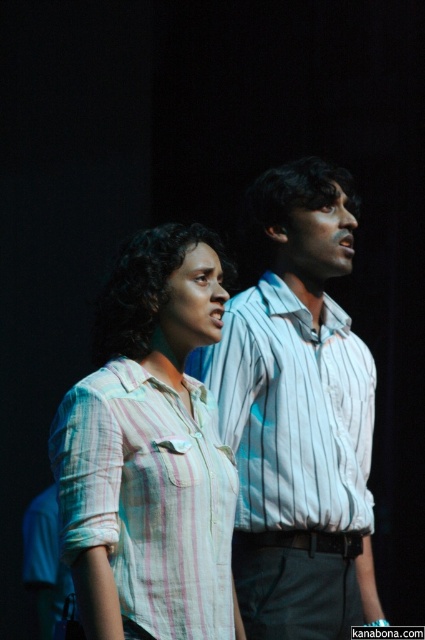
Question: Does white striped shirt at center appear on the right side of light pink striped shirt at center?

Choices:
 (A) no
 (B) yes

Answer: (B)

Question: Does white striped shirt at center appear on the right side of light pink striped shirt at center?

Choices:
 (A) no
 (B) yes

Answer: (B)

Question: Is white striped shirt at center to the left of light pink striped shirt at center from the viewer's perspective?

Choices:
 (A) yes
 (B) no

Answer: (B)